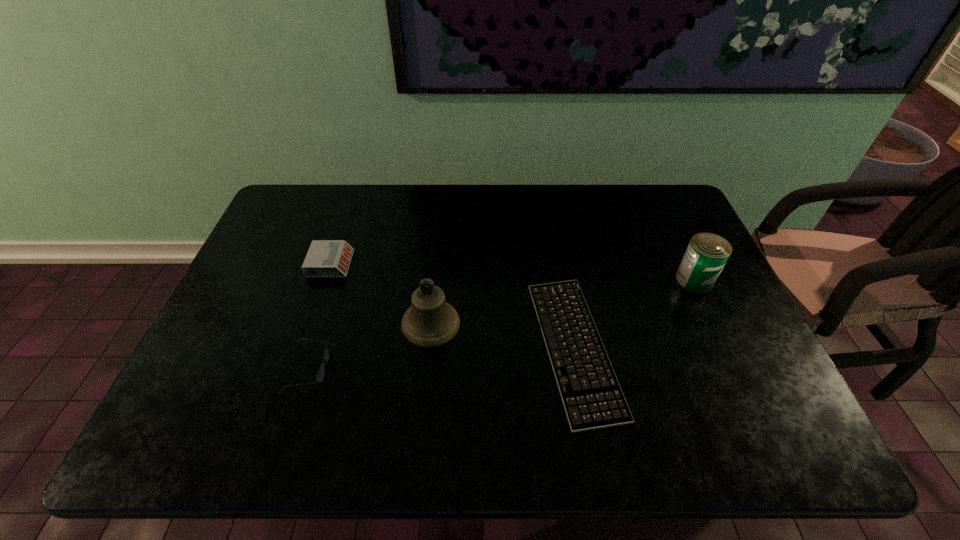
The image size is (960, 540). Find the location of `free space located 0.340m on the right of the alarm clock`. free space located 0.340m on the right of the alarm clock is located at coordinates (466, 264).

Identify the location of free space located 0.090m on the lenses of the fourth tallest object. The height and width of the screenshot is (540, 960). (365, 368).

I want to click on free space located on the left of the computer keyboard, so click(x=374, y=347).

At what (x,y) coordinates should I click in order to perform the action: click on object at the near edge. Please return your answer as a coordinate pair (x, y). Image resolution: width=960 pixels, height=540 pixels. Looking at the image, I should click on (592, 397).

I want to click on object positioned at the right edge, so click(707, 253).

In the image, there is a desktop. At what (x,y) coordinates should I click in order to perform the action: click on vacant space at the far edge. Please return your answer as a coordinate pair (x, y). Looking at the image, I should click on (550, 202).

You are a GUI agent. You are given a task and a screenshot of the screen. Output one action in this format:
    pyautogui.click(x=<x>, y=<y>)
    Task: Click on the vacant space at the near edge of the desktop
    
    Given the screenshot: What is the action you would take?
    pyautogui.click(x=438, y=446)

Where is `free region at the left edge`? This screenshot has width=960, height=540. free region at the left edge is located at coordinates (x=274, y=289).

In the image, there is a desktop. Where is `vacant region at the right edge`? vacant region at the right edge is located at coordinates (764, 365).

At what (x,y) coordinates should I click in order to perform the action: click on vacant area at the far right corner. Please return your answer as a coordinate pair (x, y). The width and height of the screenshot is (960, 540). Looking at the image, I should click on (652, 218).